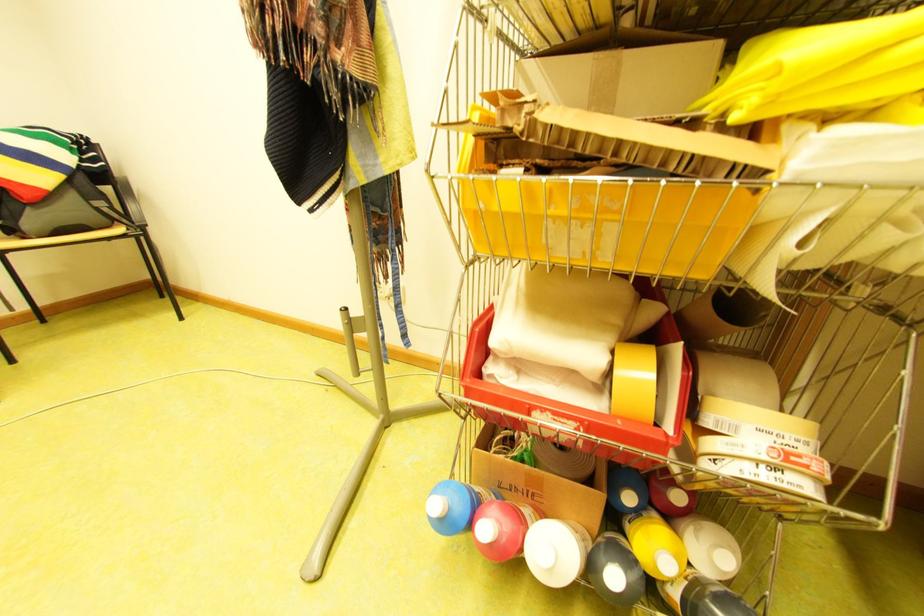
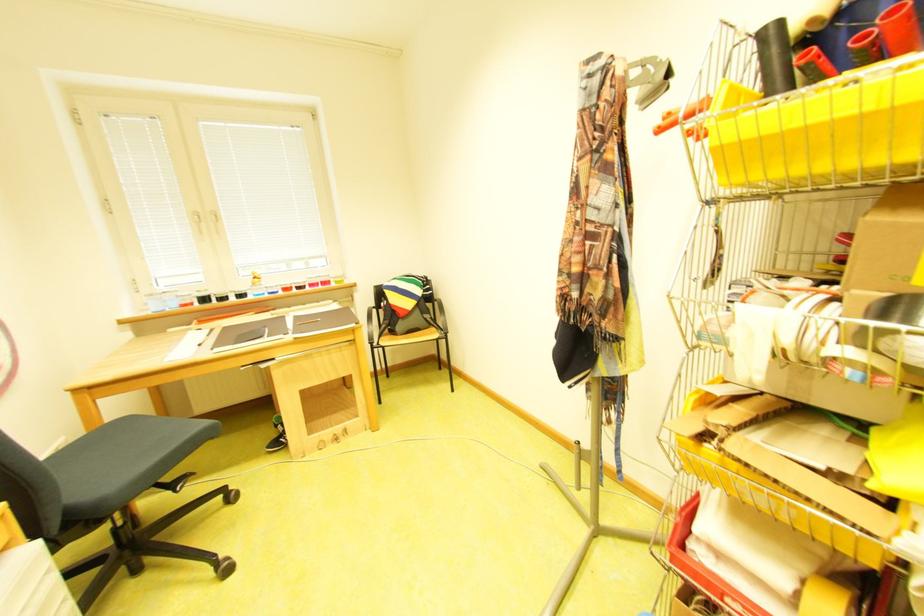
Locate, in the second image, the point that corresponds to pixel 117 222 in the first image.

(439, 326)